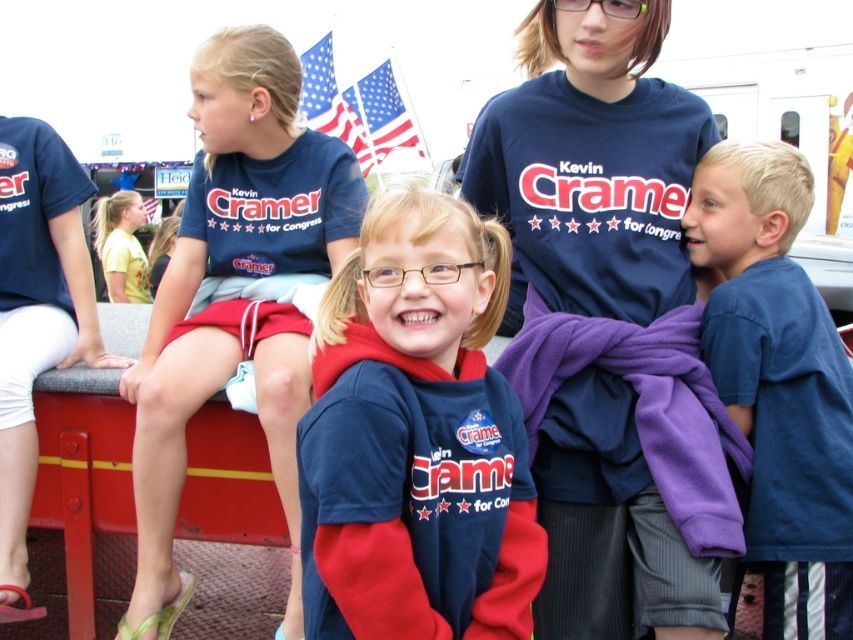
Question: Observing the image, what is the correct spatial positioning of navy blue sweatshirt at center in reference to matte blue t-shirt at upper left?

Choices:
 (A) below
 (B) above

Answer: (A)

Question: Which object is closer to the camera taking this photo?

Choices:
 (A) navy blue sweatshirt at center
 (B) matte blue t-shirt at upper left
 (C) blue cotton shirt at center

Answer: (A)

Question: Is navy blue sweatshirt at center further to camera compared to matte blue t-shirt at upper left?

Choices:
 (A) yes
 (B) no

Answer: (B)

Question: Does matte blue t-shirt at upper left have a greater width compared to blue cotton shirt at center?

Choices:
 (A) yes
 (B) no

Answer: (A)

Question: Based on their relative distances, which object is nearer to the american flag at upper center?

Choices:
 (A) matte blue t-shirt at upper left
 (B) navy blue sweatshirt at center
 (C) blue cotton shirt at center

Answer: (A)

Question: Which point is closer to the camera?

Choices:
 (A) matte blue t-shirt at upper left
 (B) blue cotton shirt at center
 (C) navy blue sweatshirt at center

Answer: (C)